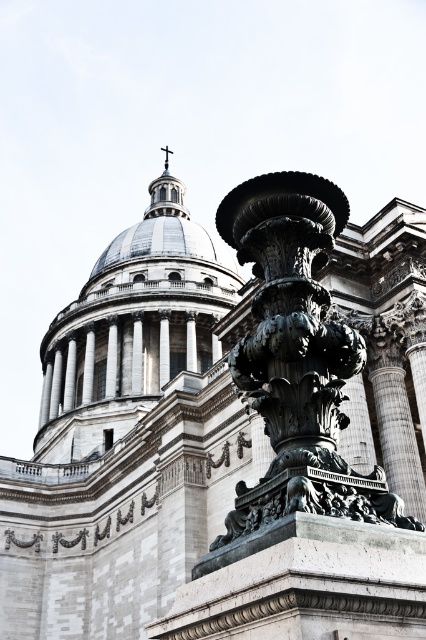
Does polished bronze fountain at center have a lesser width compared to metallic cross at upper center?

No.

Can you confirm if polished bronze fountain at center is bigger than metallic cross at upper center?

Correct, polished bronze fountain at center is larger in size than metallic cross at upper center.

Does point (310, 385) come behind point (164, 147)?

No, it is in front of (164, 147).

At what (x,y) coordinates should I click in order to perform the action: click on polished bronze fountain at center. Please return your answer as a coordinate pair (x, y). The width and height of the screenshot is (426, 640). Looking at the image, I should click on (296, 358).

Which is above, polished bronze fountain at center or white marble dome at upper center?

white marble dome at upper center is above.

Is polished bronze fountain at center further to camera compared to white marble dome at upper center?

No, polished bronze fountain at center is closer to the viewer.

Is point (333, 364) positioned before point (201, 241)?

That is True.

In order to click on polished bronze fountain at center in this screenshot , I will do `click(296, 358)`.

Can you confirm if white marble dome at upper center is thinner than metallic cross at upper center?

No, white marble dome at upper center is not thinner than metallic cross at upper center.

Who is lower down, white marble dome at upper center or metallic cross at upper center?

white marble dome at upper center is lower down.

At what (x,y) coordinates should I click in order to perform the action: click on white marble dome at upper center. Please return your answer as a coordinate pair (x, y). The image size is (426, 640). Looking at the image, I should click on (132, 328).

Image resolution: width=426 pixels, height=640 pixels. What are the coordinates of `white marble dome at upper center` in the screenshot? It's located at (132, 328).